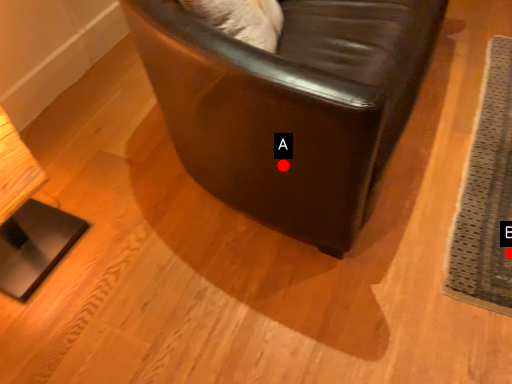
Question: Two points are circled on the image, labeled by A and B beside each circle. Which point is further to the camera?

Choices:
 (A) A is further
 (B) B is further

Answer: (B)